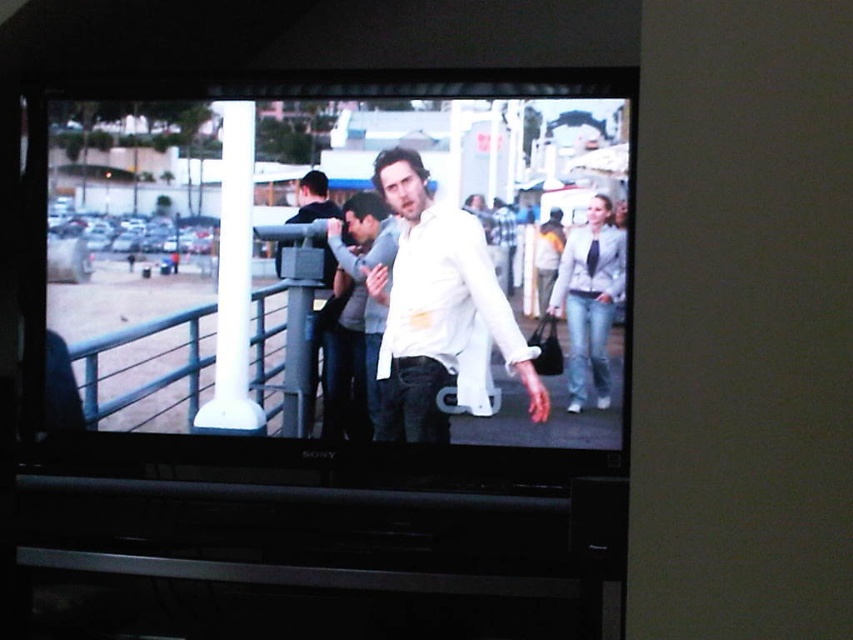
Question: Can you confirm if white glossy shirt at center is wider than white metal/rail at left?

Choices:
 (A) yes
 (B) no

Answer: (A)

Question: Can you confirm if white metal/rail at left is positioned below smooth gray pole at center?

Choices:
 (A) yes
 (B) no

Answer: (A)

Question: Is white matte shirt at center smaller than light gray textured jacket at right?

Choices:
 (A) no
 (B) yes

Answer: (A)

Question: Which of these objects is positioned farthest from the light gray textured jacket at right?

Choices:
 (A) white glossy shirt at center
 (B) white metal/rail at left
 (C) white matte shirt at center

Answer: (B)

Question: Which of the following is the closest to the observer?

Choices:
 (A) white matte shirt at center
 (B) light gray textured jacket at right
 (C) smooth gray pole at center
 (D) white metal/rail at left

Answer: (B)

Question: Which object is farther from the camera taking this photo?

Choices:
 (A) smooth gray pole at center
 (B) white metal/rail at left
 (C) light gray textured jacket at right
 (D) white matte shirt at center

Answer: (B)